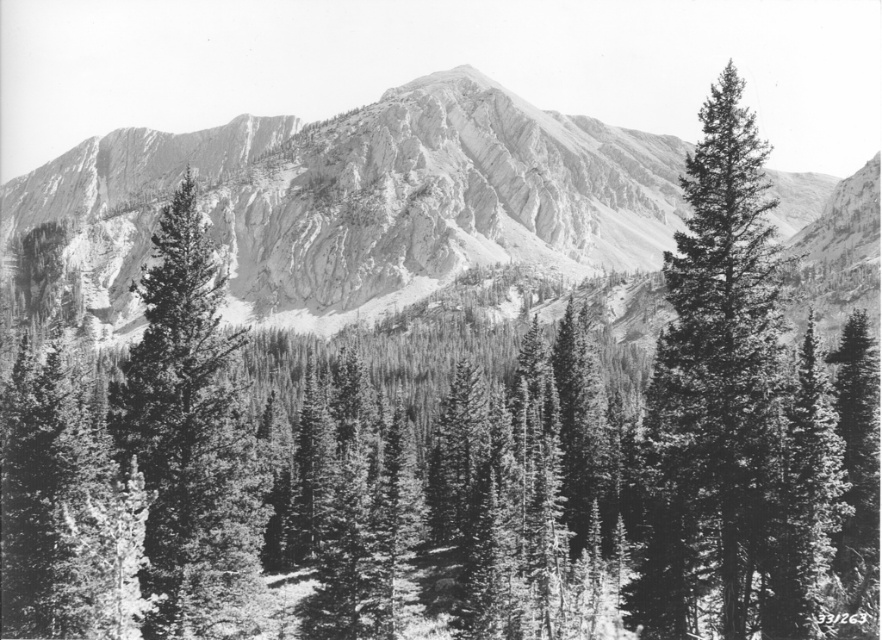
Between smooth green pine tree at center and smooth bark evergreen at center, which one has less height?

With less height is smooth green pine tree at center.

Between smooth green pine tree at center and smooth bark evergreen at center, which one has more height?

With more height is smooth bark evergreen at center.

Is point (670, 394) positioned in front of point (222, 522)?

Yes, it is in front of point (222, 522).

The width and height of the screenshot is (882, 640). I want to click on smooth green pine tree at center, so click(x=714, y=385).

Between rugged stone mountain range at center and smooth green pine tree at center, which one is positioned lower?

smooth green pine tree at center is below.

Who is more distant from viewer, (153,168) or (714,476)?

Point (153,168)

Find the location of `rugged stone mountain range at center`. rugged stone mountain range at center is located at coordinates (368, 198).

Does smooth green pine tree at center have a lesser width compared to smooth green pine tree at right?

No.

Can you confirm if smooth green pine tree at center is shorter than smooth green pine tree at right?

In fact, smooth green pine tree at center may be taller than smooth green pine tree at right.

Does point (684, 346) lie behind point (818, 573)?

No, (684, 346) is in front of (818, 573).

This screenshot has height=640, width=882. Find the location of `smooth green pine tree at center`. smooth green pine tree at center is located at coordinates (714, 385).